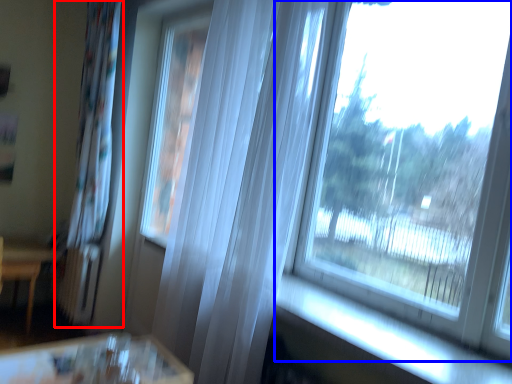
Question: Which of the following is the closest to the observer, curtain (highlighted by a red box) or window (highlighted by a blue box)?

Choices:
 (A) curtain
 (B) window

Answer: (B)